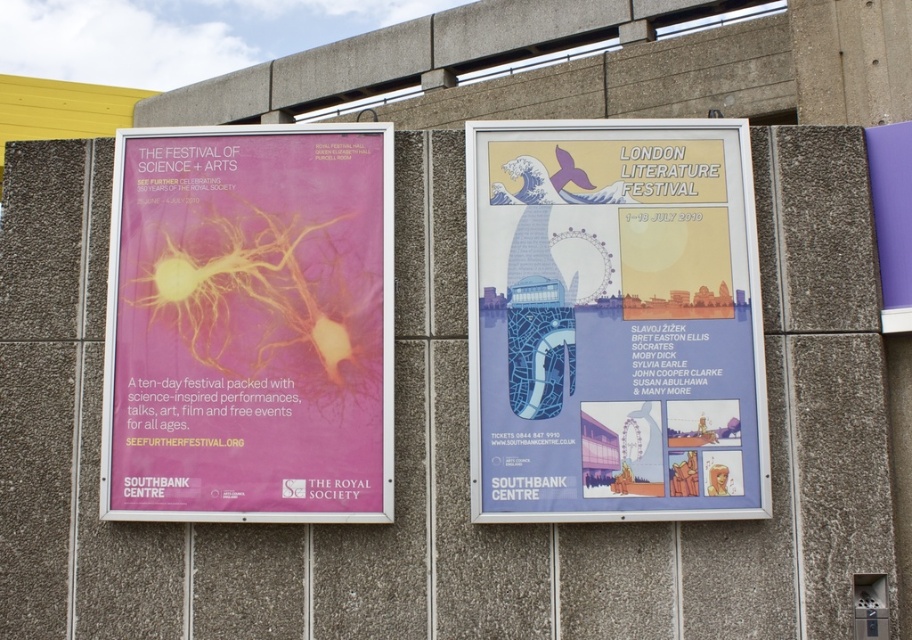
Looking at this image, you are an art curator planning to hang a new poster exactly at the coordinates 0.503, 0.674 on the wall. However, you notice there is already a matte blue poster at center at this location. What should you do?

The matte blue poster at center is already positioned at the coordinates [614,321], so you cannot hang the new poster there without removing or relocating the existing one.

You are an event planner organizing a new exhibition and need to hang a third poster between the existing ones. Given the current arrangement of the matte blue poster at center and the matte pink poster at left, where should you place the new poster to maintain symmetry?

To maintain symmetry between the matte blue poster at center and the matte pink poster at left, the new poster should be placed to the right of the matte blue poster at center, mirroring the position of the matte pink poster at left.